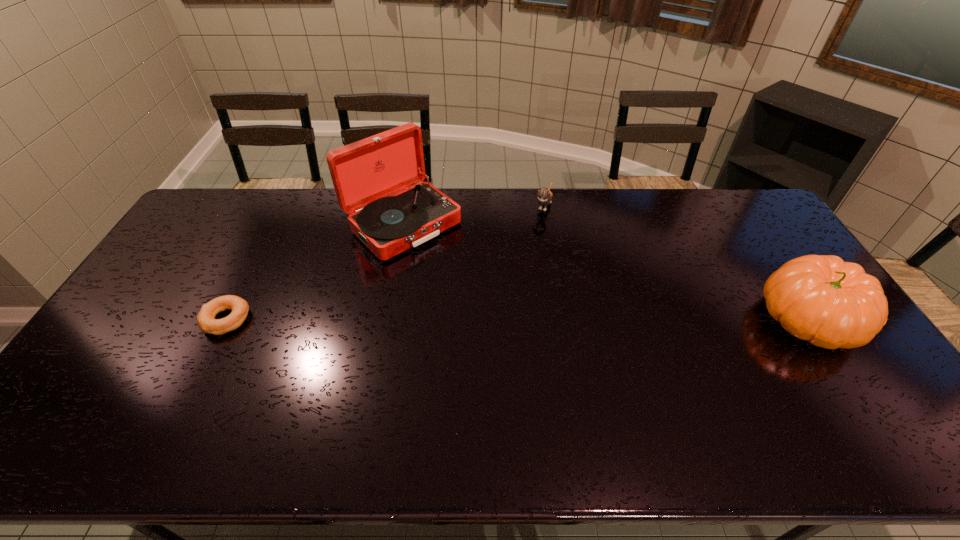
This screenshot has height=540, width=960. Find the location of `free space at the left edge of the desktop`. free space at the left edge of the desktop is located at coordinates (93, 372).

This screenshot has width=960, height=540. In the image, there is a desktop. Identify the location of free space at the right edge. (784, 248).

This screenshot has height=540, width=960. What are the coordinates of `free space at the far left corner of the desktop` in the screenshot? It's located at pyautogui.click(x=209, y=214).

Where is `unoccupied area between the second tallest object and the tallest object`? The image size is (960, 540). unoccupied area between the second tallest object and the tallest object is located at coordinates (606, 272).

Identify the location of free space between the third object from right to left and the shortest object. Image resolution: width=960 pixels, height=540 pixels. point(315,272).

This screenshot has width=960, height=540. In order to click on free spot between the rightmost object and the bagel in this screenshot , I will do (x=517, y=319).

The image size is (960, 540). Identify the location of vacant space that is in between the bagel and the rightmost object. (517, 319).

Where is `vacant point located between the kitten and the pumpkin`? vacant point located between the kitten and the pumpkin is located at coordinates (676, 262).

At what (x,y) coordinates should I click in order to perform the action: click on free space between the tallest object and the third tallest object. Please return your answer as a coordinate pair (x, y). This screenshot has width=960, height=540. Looking at the image, I should click on (473, 215).

What are the coordinates of `blank region between the leftmost object and the kitten` in the screenshot? It's located at (385, 262).